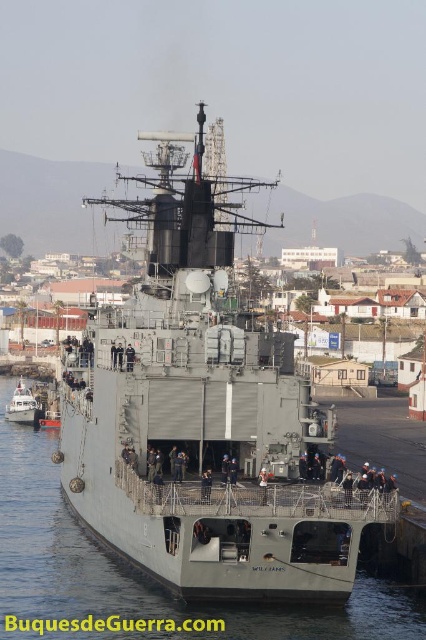
Who is positioned more to the left, gray metallic water at lower center or white matte boat at lower left?

From the viewer's perspective, white matte boat at lower left appears more on the left side.

Consider the image. Is gray metallic water at lower center further to the viewer compared to white matte boat at lower left?

That is False.

Is point (229, 625) farther from viewer compared to point (31, 420)?

No.

Find the location of a particular element. The height and width of the screenshot is (640, 426). gray metallic water at lower center is located at coordinates (138, 572).

Between gray matte ship at center and gray metallic water at lower center, which one has less height?

gray metallic water at lower center is shorter.

Between point (203, 563) and point (14, 429), which one is positioned behind?

The point (14, 429) is behind.

Is point (83, 381) positioned behind point (363, 637)?

Yes, it is.

At what (x,y) coordinates should I click in order to perform the action: click on gray matte ship at center. Please return your answer as a coordinate pair (x, y). Image resolution: width=426 pixels, height=640 pixels. Looking at the image, I should click on (204, 417).

Can you confirm if gray matte ship at center is positioned above white matte boat at lower left?

Yes.

Does point (222, 291) come in front of point (5, 417)?

Yes, point (222, 291) is in front of point (5, 417).

Describe the element at coordinates (204, 417) in the screenshot. I see `gray matte ship at center` at that location.

Find the location of a particular element. gray matte ship at center is located at coordinates (204, 417).